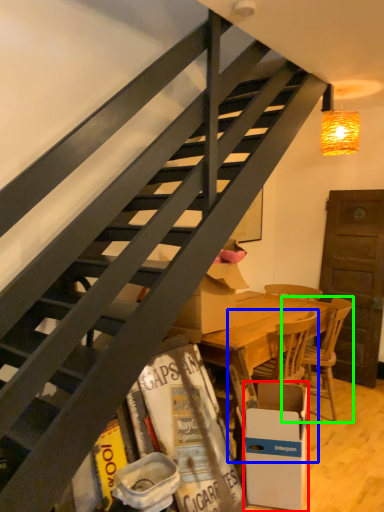
Question: Which is nearer to the box (highlighted by a red box)? chair (highlighted by a blue box) or chair (highlighted by a green box).

Choices:
 (A) chair
 (B) chair

Answer: (A)